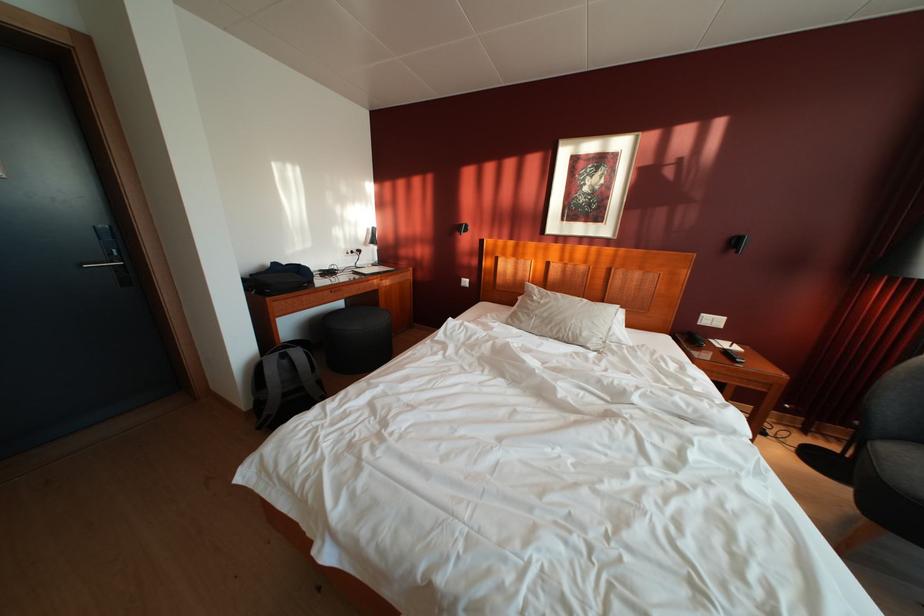
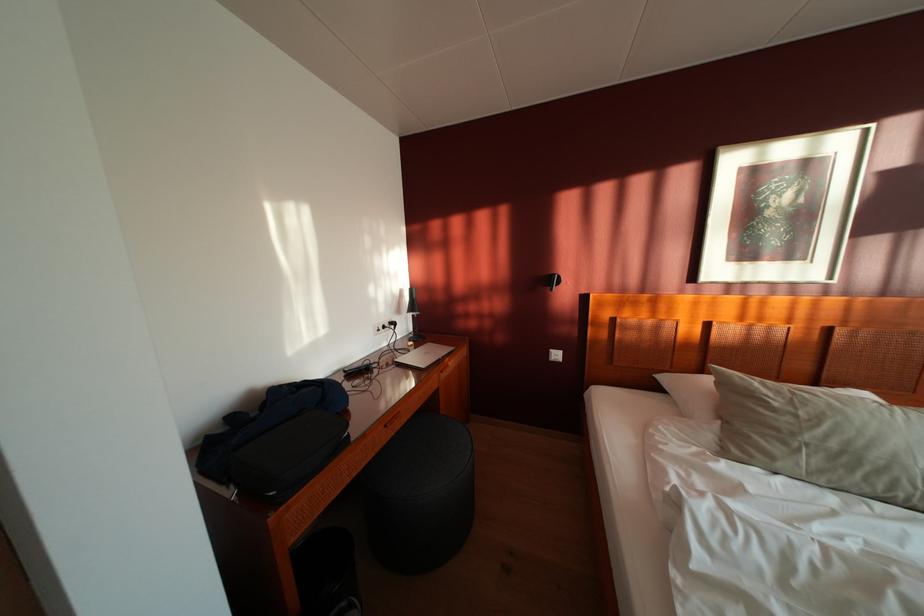
In the second image, find the point that corresponds to (384,265) in the first image.

(419, 334)